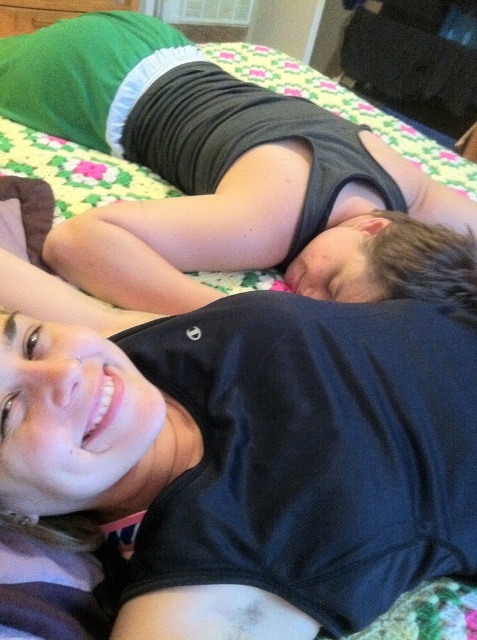
Question: Which point appears farthest from the camera in this image?

Choices:
 (A) (68, 412)
 (B) (105, 20)

Answer: (B)

Question: Does black matte tank top at upper center appear over matte black tank top at center?

Choices:
 (A) yes
 (B) no

Answer: (B)

Question: Which object is closer to the camera taking this photo?

Choices:
 (A) matte black tank top at center
 (B) black matte tank top at upper center

Answer: (B)

Question: From the image, what is the correct spatial relationship of black matte tank top at upper center in relation to matte black tank top at center?

Choices:
 (A) below
 (B) above

Answer: (A)

Question: Is black matte tank top at upper center closer to the viewer compared to matte black tank top at center?

Choices:
 (A) no
 (B) yes

Answer: (B)